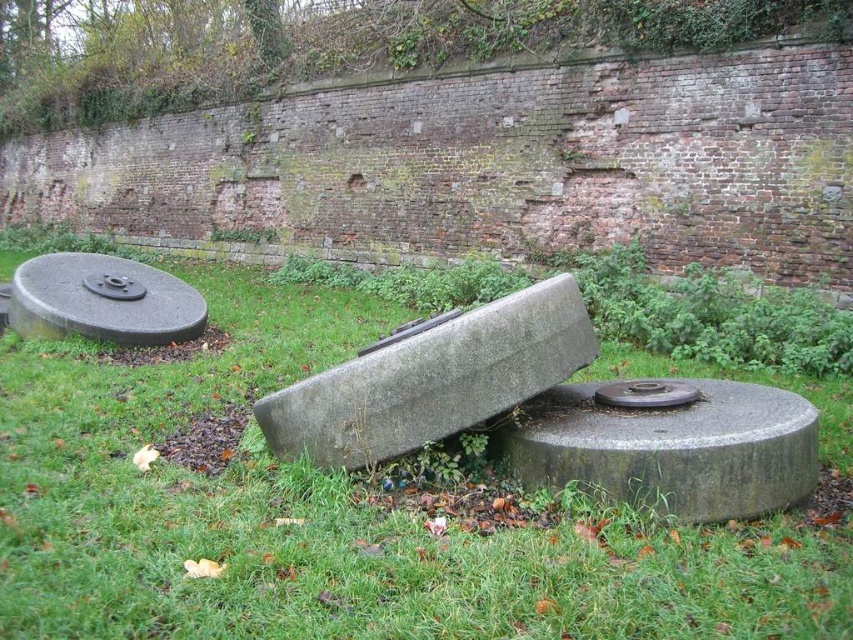
Is gray concrete at center above smooth gray concrete at left?

Actually, gray concrete at center is below smooth gray concrete at left.

At what (x,y) coordinates should I click in order to perform the action: click on gray concrete at center. Please return your answer as a coordinate pair (x, y). The image size is (853, 640). Looking at the image, I should click on (672, 449).

Is green grass at center above gray concrete at center?

No, green grass at center is not above gray concrete at center.

Does green grass at center have a greater width compared to gray concrete at center?

Yes.

Does point (212, 593) come behind point (642, 481)?

No, (212, 593) is closer to viewer.

Locate an element on the screen. green grass at center is located at coordinates (329, 516).

Between gray concrete cement at center and smooth gray concrete at left, which one has less height?

gray concrete cement at center is shorter.

Find the location of `gray concrete cement at center`. gray concrete cement at center is located at coordinates [x=432, y=378].

Who is more forward, (469, 392) or (180, 282)?

Point (469, 392)

Find the location of a particular element. gray concrete cement at center is located at coordinates (432, 378).